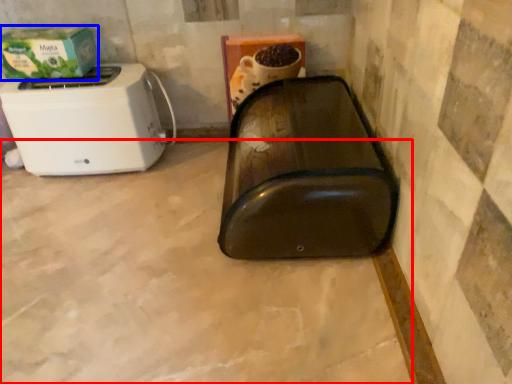
Question: Which of the following is the closest to the observer, concrete (highlighted by a red box) or box (highlighted by a blue box)?

Choices:
 (A) concrete
 (B) box

Answer: (A)